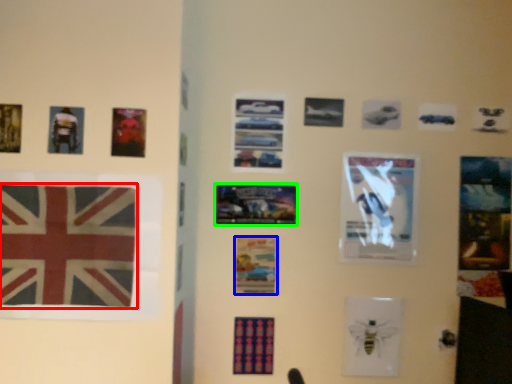
Question: Which object is positioned farthest from flag (highlighted by a red box)? Select from poster (highlighted by a blue box) and poster (highlighted by a green box).

Choices:
 (A) poster
 (B) poster

Answer: (A)